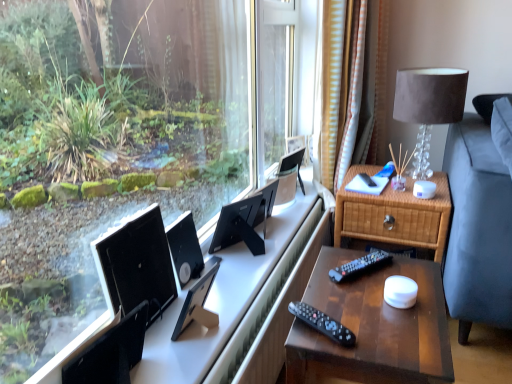
The height and width of the screenshot is (384, 512). I want to click on free space between black plastic remote control at lower center, placed as the first remote control when sorted from left to right, and black plastic remote control at lower center, which is the first remote control in back-to-front order, so click(346, 299).